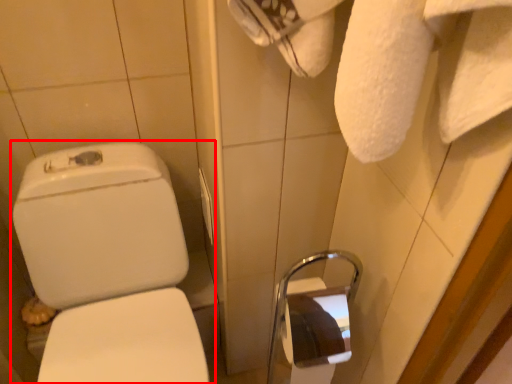
Question: Considering the relative positions of toilet (annotated by the red box) and towel bar in the image provided, where is toilet (annotated by the red box) located with respect to the staircase?

Choices:
 (A) right
 (B) left

Answer: (B)